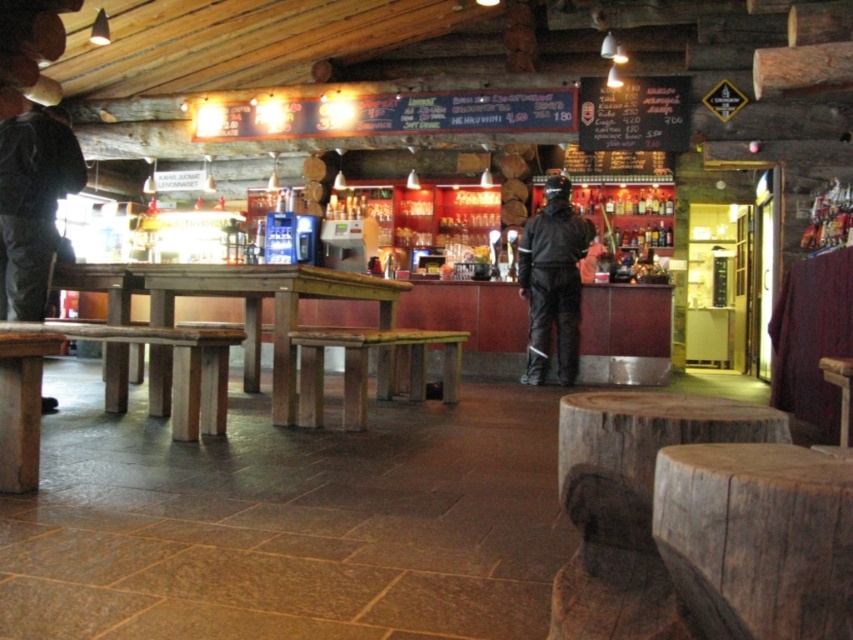
You are standing at the entrance of the rustic bar and want to place a new bench exactly where the wooden table at center is currently located. Is this possible? Please explain why or why not based on the existing layout.

The wooden table at center is located at coordinates point (260, 307), so placing a new bench there would require removing the existing table first since the position is already occupied.

Looking at this image, you are a customer entering the rustic bar and want to sit down. You see the wooden table at center and the black matte jacket at center. Which object is shorter and more suitable for sitting on?

The wooden table at center has a lesser height compared to the black matte jacket at center, so it is shorter and more suitable for sitting on.

You are a customer sitting at the wooden bar stool at center. You notice a black matte jacket at center in front of you. Can you reach the jacket without leaving your seat?

The black matte jacket at center is further to the viewer than the wooden bar stool at center, meaning it is closer to you. Since it is within reach while sitting, you can likely reach it without leaving your seat.